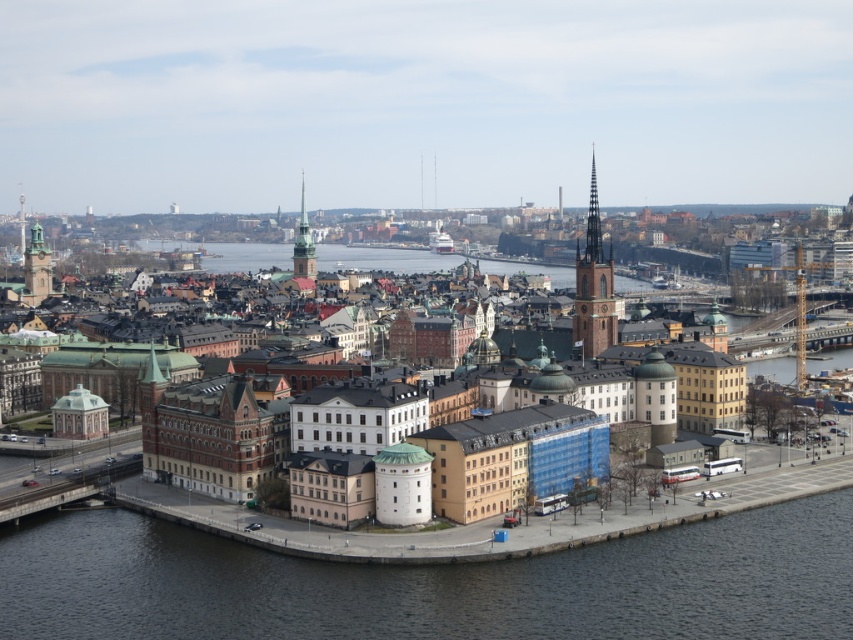
Who is positioned more to the right, dark gray water at lower center or matte copper clock tower at left?

dark gray water at lower center

Which of these two, dark gray water at lower center or matte copper clock tower at left, stands taller?

matte copper clock tower at left is taller.

The image size is (853, 640). Find the location of `dark gray water at lower center`. dark gray water at lower center is located at coordinates (433, 584).

Who is positioned more to the left, brown stone tower at center or green stone tower at center?

green stone tower at center

Does brown stone tower at center have a lesser height compared to green stone tower at center?

Yes.

Who is more distant from viewer, (602, 294) or (310, 278)?

The point (310, 278) is behind.

This screenshot has height=640, width=853. What are the coordinates of `brown stone tower at center` in the screenshot? It's located at (593, 285).

Can you confirm if dark gray water at lower center is smaller than green stone tower at center?

Indeed, dark gray water at lower center has a smaller size compared to green stone tower at center.

Which is above, dark gray water at lower center or green stone tower at center?

green stone tower at center

This screenshot has height=640, width=853. I want to click on dark gray water at lower center, so click(433, 584).